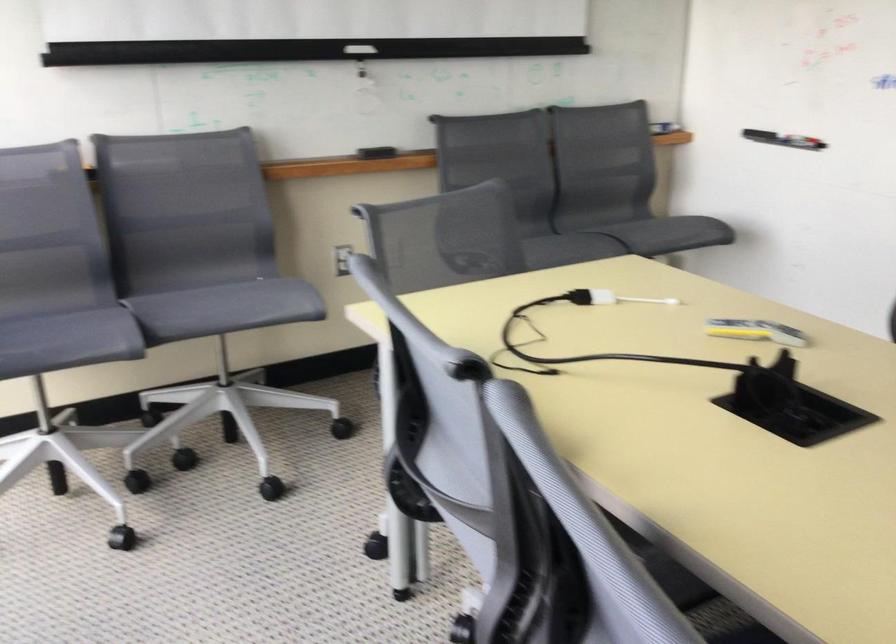
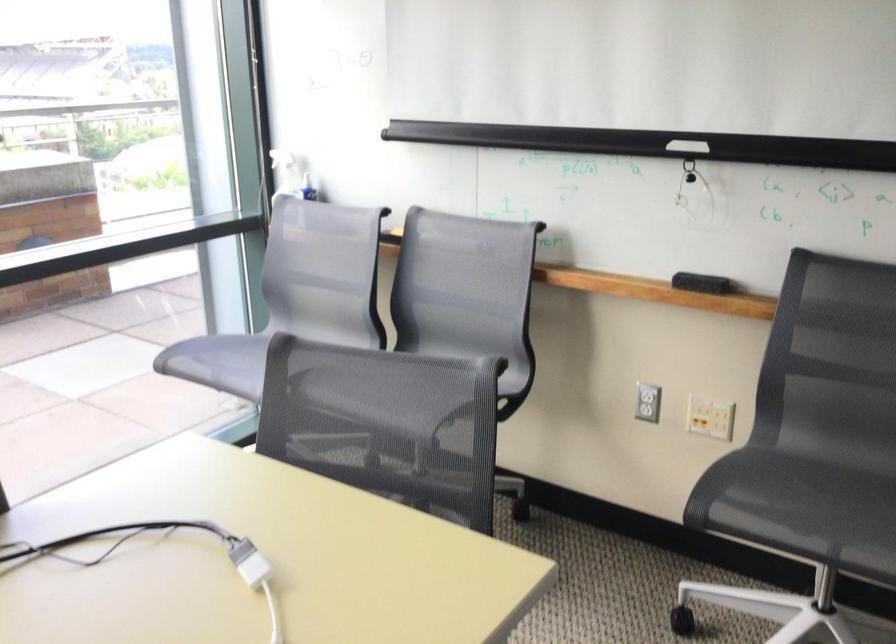
Question: I am providing you with two images of the same scene from different viewpoints. Please identify which objects are invisible in image2.

Choices:
 (A) projector screen handle
 (B) chair sitting surface
 (C) white spray bottle
 (D) pink magazine file

Answer: (B)